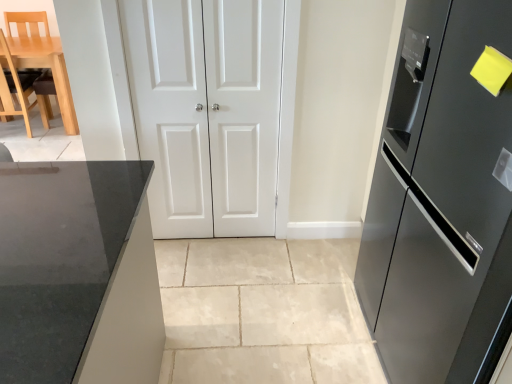
Question: Relative to satin black refrigerator at right, is white glossy door at center, which is counted as the first door, starting from the left, in front or behind?

Choices:
 (A) behind
 (B) front

Answer: (A)

Question: In terms of width, does white glossy door at center, which is counted as the 2th door, starting from the right, look wider or thinner when compared to satin black refrigerator at right?

Choices:
 (A) wide
 (B) thin

Answer: (B)

Question: Which of these objects is positioned closest to the light wood/leather chair at left?

Choices:
 (A) white glossy door at center, which is counted as the first door, starting from the left
 (B) white matte door at center, which is the second door in left-to-right order
 (C) satin black refrigerator at right

Answer: (A)

Question: Considering the real-world distances, which object is closest to the white matte door at center, the 1th door in the right-to-left sequence?

Choices:
 (A) satin black refrigerator at right
 (B) light wood/leather chair at left
 (C) white glossy door at center, which is counted as the 2th door, starting from the right

Answer: (C)